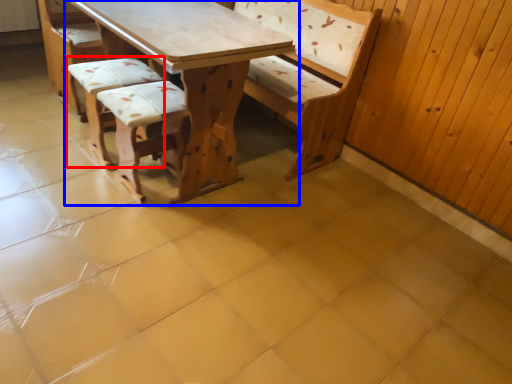
Question: Which of the following is the farthest to the observer, armchair (highlighted by a red box) or table (highlighted by a blue box)?

Choices:
 (A) armchair
 (B) table

Answer: (A)